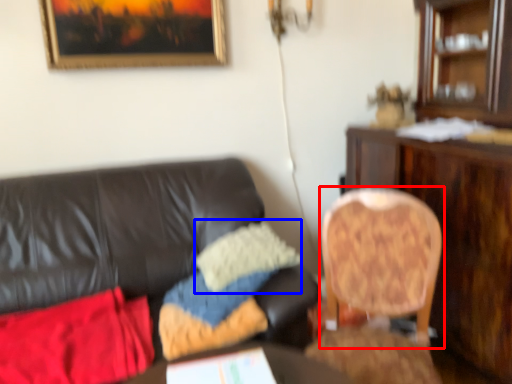
Question: Which object is closer to the camera taking this photo, chair (highlighted by a red box) or pillow (highlighted by a blue box)?

Choices:
 (A) chair
 (B) pillow

Answer: (A)